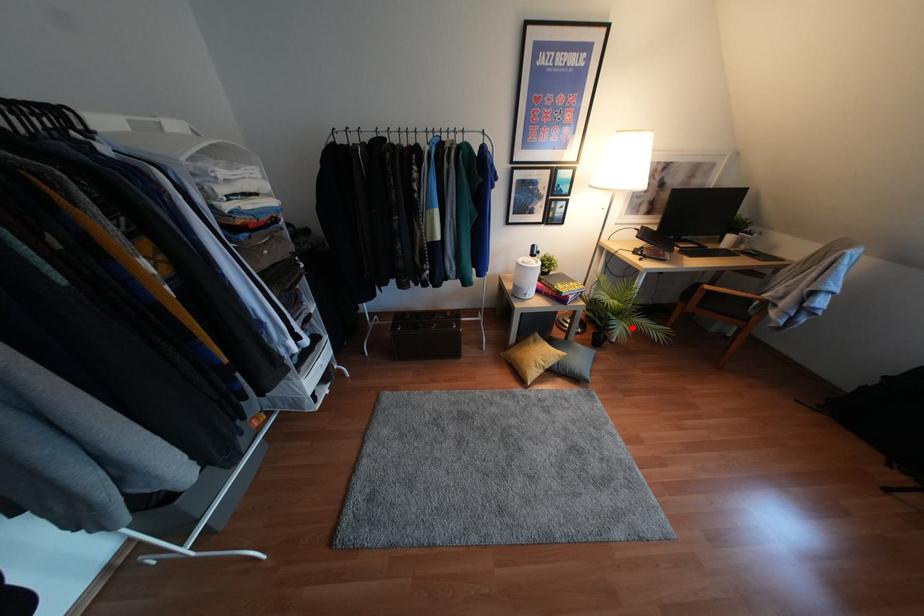
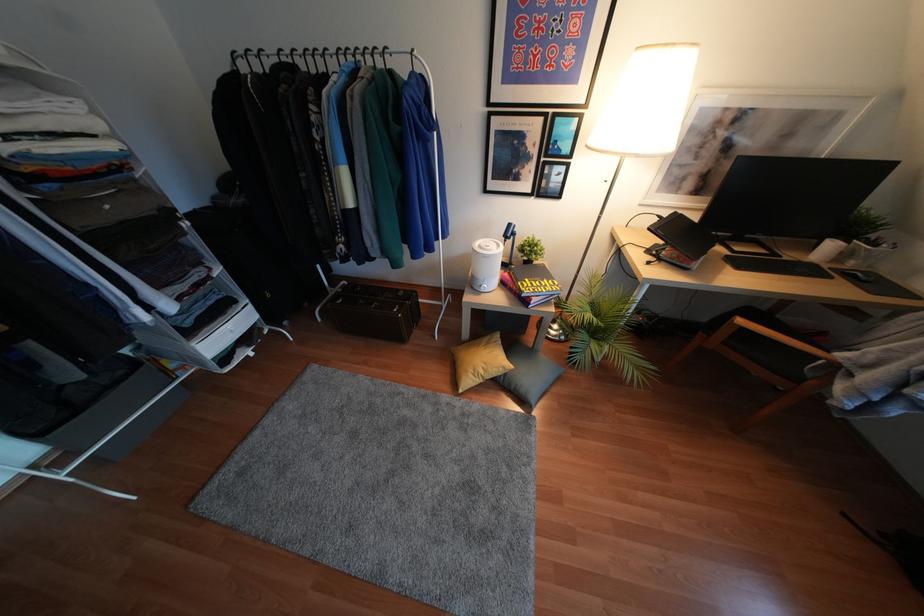
Question: I am providing you with two images of the same scene from different viewpoints. A red point is marked on the first image. Can you still see the location of the red point in image 2?

Choices:
 (A) Yes
 (B) No

Answer: (A)